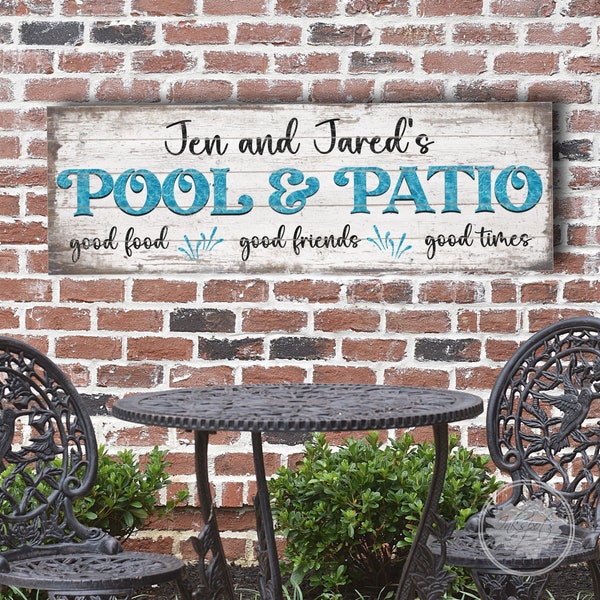
This screenshot has width=600, height=600. Find the location of `seat on chair`. seat on chair is located at coordinates (66, 566).